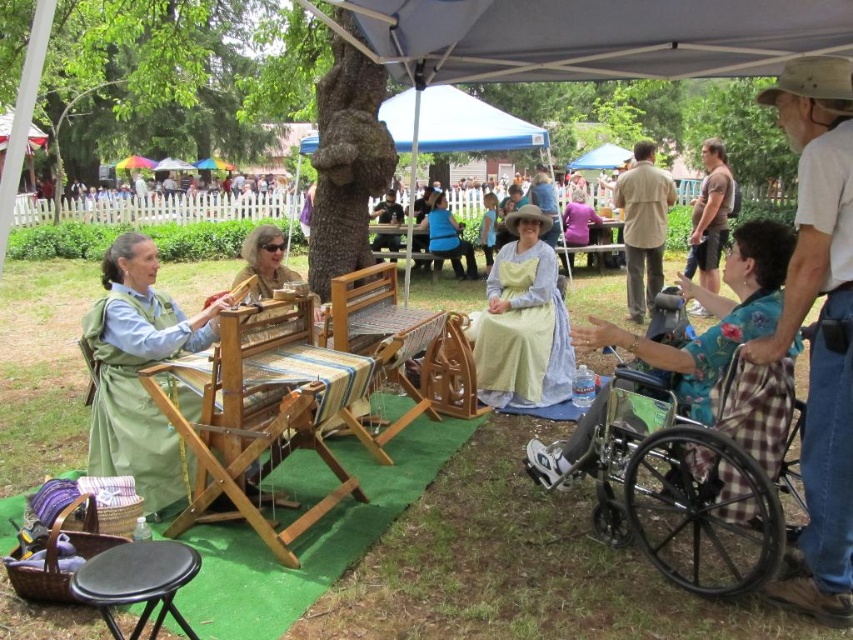
Consider the image. You are standing at the camera position in the scene. There is a green cotton apron at left that you want to photograph. Can you reach it without moving the camera more than 3 meters?

The green cotton apron at left and the camera are 3.13 meters apart from each other. Since the distance is slightly more than 3 meters, you cannot reach it without moving the camera more than 3 meters.

What are the coordinates of the green cotton apron at left?

The green cotton apron at left is located at coordinates point (136, 371).

You are a photographer at the event and want to capture both the green cotton apron at left and the brown cotton shirt at upper right in a single shot. Based on their positions, which one should you focus on first to ensure both are in frame?

The green cotton apron at left is below the brown cotton shirt at upper right, so focus on the brown cotton shirt at upper right first to ensure both are within the camera frame.